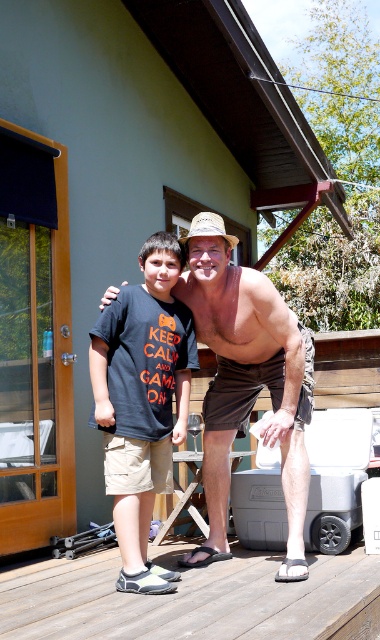
Question: Is brown wooden deck at lower center in front of dark gray cotton t-shirt at center?

Choices:
 (A) no
 (B) yes

Answer: (B)

Question: Which point is closer to the camera?

Choices:
 (A) brown wooden deck at lower center
 (B) brown cotton shorts at center

Answer: (A)

Question: Among these objects, which one is farthest from the camera?

Choices:
 (A) brown cotton shorts at center
 (B) brown wooden deck at lower center
 (C) dark gray cotton t-shirt at center

Answer: (A)

Question: Does brown wooden deck at lower center have a larger size compared to dark gray cotton t-shirt at center?

Choices:
 (A) no
 (B) yes

Answer: (B)

Question: Can you confirm if brown wooden deck at lower center is positioned to the left of dark gray cotton t-shirt at center?

Choices:
 (A) yes
 (B) no

Answer: (B)

Question: Which object is closer to the camera taking this photo?

Choices:
 (A) brown cotton shorts at center
 (B) dark gray cotton t-shirt at center

Answer: (B)